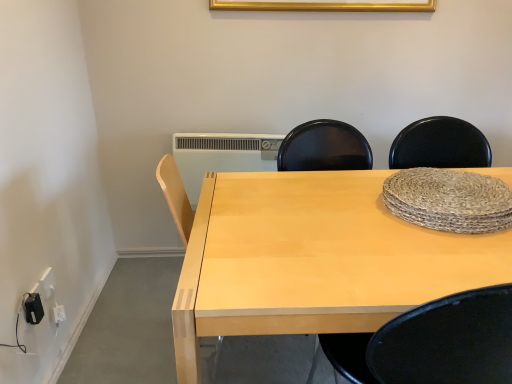
Question: Based on their sizes in the image, would you say light wood desk at center is bigger or smaller than white plastic electric outlet at lower left, marked as the first electric outlet in a left-to-right arrangement?

Choices:
 (A) small
 (B) big

Answer: (B)

Question: Considering the positions of light wood desk at center and white plastic electric outlet at lower left, the 2th electric outlet in the right-to-left sequence, in the image, is light wood desk at center wider or thinner than white plastic electric outlet at lower left, the 2th electric outlet in the right-to-left sequence,?

Choices:
 (A) wide
 (B) thin

Answer: (A)

Question: Which is farther from the gold metallic picture frame at upper center?

Choices:
 (A) light wood desk at center
 (B) black plastic electric outlet at lower left, which ranks as the 1th electric outlet in right-to-left order
 (C) white plastic electric outlet at lower left, the 2th electric outlet in the right-to-left sequence
 (D) white plastic radiator at center

Answer: (B)

Question: Estimate the real-world distances between objects in this image. Which object is closer to the white plastic radiator at center?

Choices:
 (A) black plastic electric outlet at lower left, the 2th electric outlet when ordered from back to front
 (B) light wood desk at center
 (C) gold metallic picture frame at upper center
 (D) white plastic electric outlet at lower left, arranged as the second electric outlet when viewed from the front

Answer: (C)